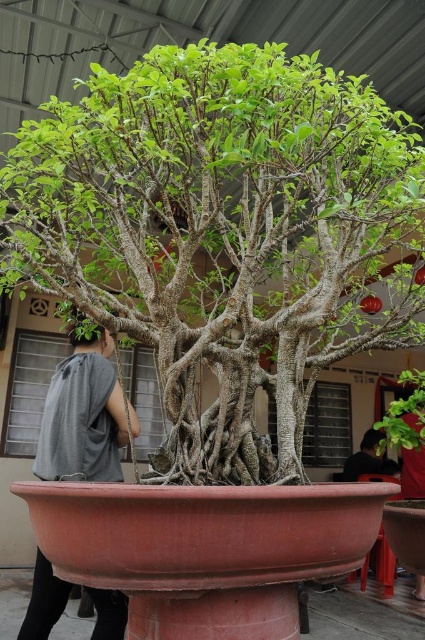
From the picture: You are a gardener who needs to water both the green textured bonsai at center and the green matte plant at center. Since you have a watering can with a 30 inch long handle, can you water both plants without moving the watering can? Explain your reasoning.

The green textured bonsai at center is 29.24 inches away from the green matte plant at center. Since the watering can has a 30 inch handle, it is just long enough to reach both plants without moving the can. The gardener can water the closer plant first, then extend the handle fully to reach the other one.

You are a gardener who needs to place a new decorative item between the green textured bonsai at center and the green matte plant at center. The item is 1 meter wide. Is there enough space between them to fit the item?

The green textured bonsai at center is larger than the green matte plant at center, but the exact distance between them isn